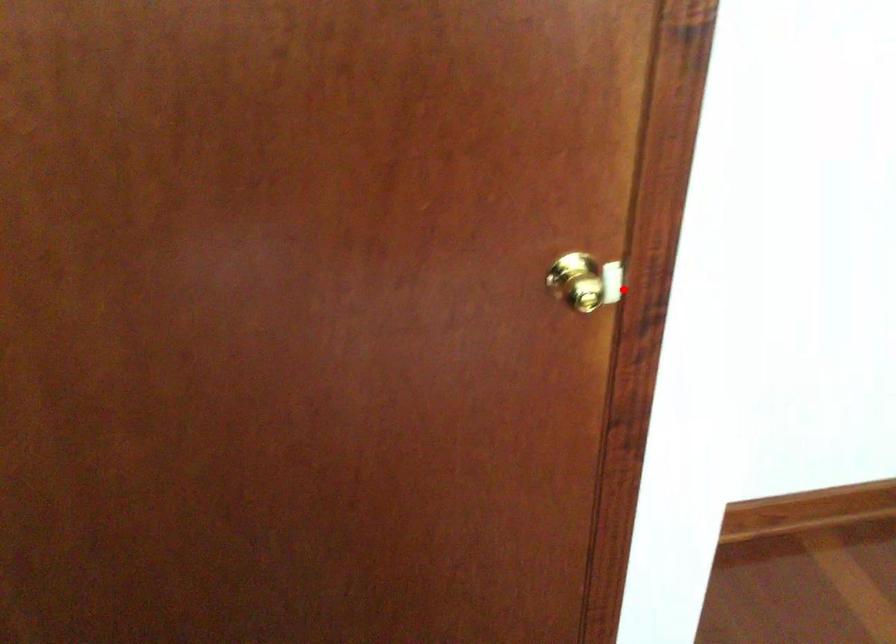
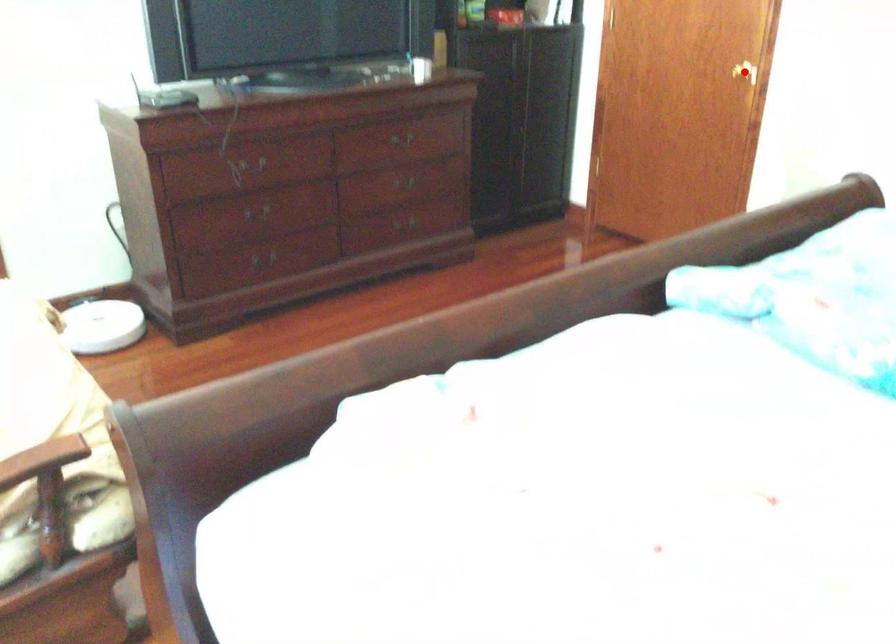
I am providing you with two images of the same scene from different viewpoints. A red point is marked on the first image and another point is marked on the second image. Are the points marked in image1 and image2 representing the same 3D position?

Yes